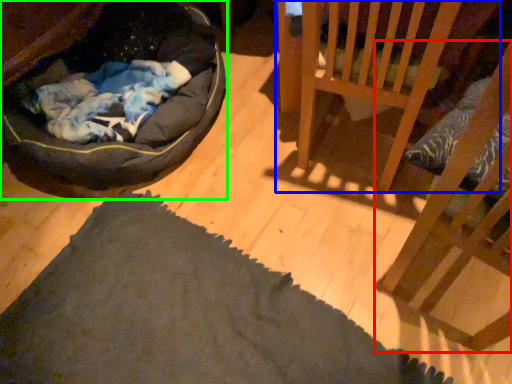
Question: Estimate the real-world distances between objects in this image. Which object is closer to furniture (highlighted by a red box), furniture (highlighted by a blue box) or dog bed (highlighted by a green box)?

Choices:
 (A) furniture
 (B) dog bed

Answer: (A)